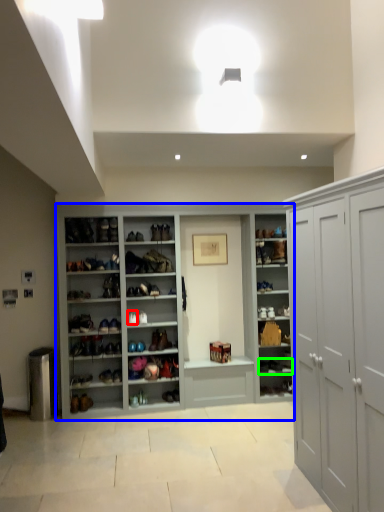
Question: Considering the real-world distances, which object is closest to shoe (highlighted by a red box)? cupboard (highlighted by a blue box) or footwear (highlighted by a green box).

Choices:
 (A) cupboard
 (B) footwear

Answer: (A)